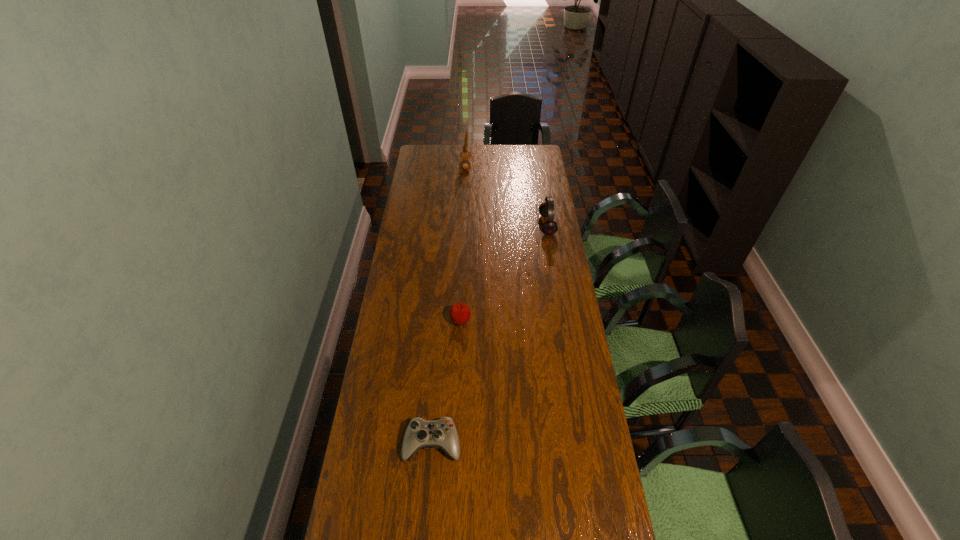
Identify the location of free location located 0.240m on the ear cups of the third nearest object. (489, 225).

Locate an element on the screen. This screenshot has height=540, width=960. blank space located 0.150m on the back of the third farthest object is located at coordinates (462, 285).

Where is `vacant space located 0.100m on the left of the nearest object`? vacant space located 0.100m on the left of the nearest object is located at coordinates [x=372, y=443].

At what (x,y) coordinates should I click in order to perform the action: click on object at the far edge. Please return your answer as a coordinate pair (x, y). Image resolution: width=960 pixels, height=540 pixels. Looking at the image, I should click on (465, 155).

Image resolution: width=960 pixels, height=540 pixels. Identify the location of object that is at the left edge. (420, 433).

Locate an element on the screen. This screenshot has height=540, width=960. object positioned at the right edge is located at coordinates (546, 209).

Locate an element on the screen. vacant space at the far edge of the desktop is located at coordinates (509, 165).

Locate an element on the screen. The width and height of the screenshot is (960, 540). vacant position at the left edge of the desktop is located at coordinates click(414, 388).

Image resolution: width=960 pixels, height=540 pixels. I want to click on free location at the right edge of the desktop, so click(x=528, y=199).

Locate an element on the screen. vacant region between the rightmost object and the left earphone is located at coordinates (506, 195).